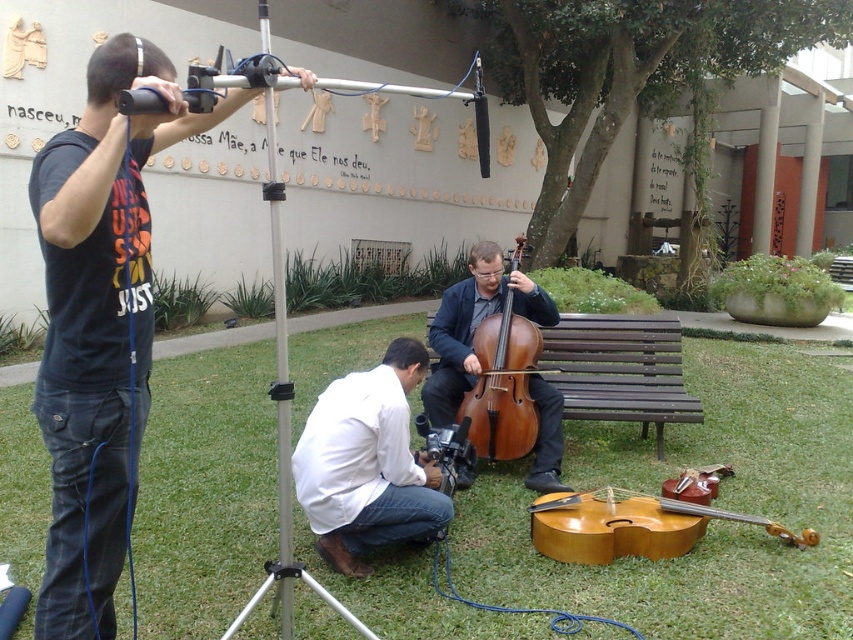
Who is higher up, brown wooden bench at center or brown wooden cello at center?

brown wooden cello at center is above.

Looking at this image, who is shorter, brown wooden bench at center or brown wooden cello at center?

With less height is brown wooden bench at center.

What do you see at coordinates (619, 371) in the screenshot? I see `brown wooden bench at center` at bounding box center [619, 371].

Image resolution: width=853 pixels, height=640 pixels. I want to click on brown wooden bench at center, so click(x=619, y=371).

Who is positioned more to the right, dark blue t-shirt at left or brown wooden cello at center?

brown wooden cello at center

Between dark blue t-shirt at left and brown wooden cello at center, which one has more height?

Standing taller between the two is dark blue t-shirt at left.

The image size is (853, 640). What do you see at coordinates (97, 320) in the screenshot?
I see `dark blue t-shirt at left` at bounding box center [97, 320].

Find the location of a particular element. dark blue t-shirt at left is located at coordinates (97, 320).

Based on the photo, can you confirm if dark blue t-shirt at left is positioned to the right of brown wooden bench at center?

In fact, dark blue t-shirt at left is to the left of brown wooden bench at center.

Is dark blue t-shirt at left taller than brown wooden bench at center?

Yes, dark blue t-shirt at left is taller than brown wooden bench at center.

Locate an element on the screen. Image resolution: width=853 pixels, height=640 pixels. dark blue t-shirt at left is located at coordinates (97, 320).